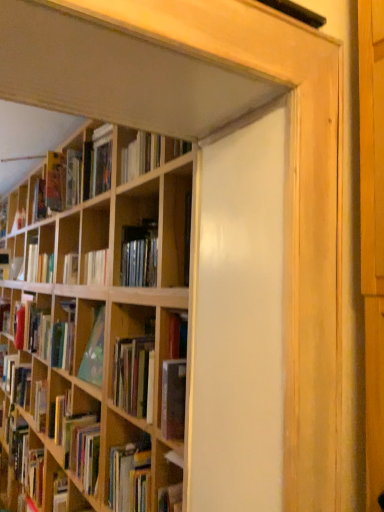
Question: Is hardcover book at upper left, the 1th book in the front-to-back sequence, bigger or smaller than matte red book at left, which ranks as the first book in bottom-to-top order?

Choices:
 (A) big
 (B) small

Answer: (A)

Question: In the image, is hardcover book at upper left, which is the first book in right-to-left order, on the left side or the right side of matte red book at left, which is the 2th book from right to left?

Choices:
 (A) left
 (B) right

Answer: (B)

Question: Choose the correct answer: Is hardcover book at upper left, the 1th book viewed from the top, inside matte red book at left, which ranks as the first book in bottom-to-top order, or outside it?

Choices:
 (A) outside
 (B) inside

Answer: (A)

Question: From a real-world perspective, relative to hardcover book at upper left, the 1th book in the front-to-back sequence, is matte red book at left, the 2th book viewed from the front, vertically above or below?

Choices:
 (A) above
 (B) below

Answer: (B)

Question: Relative to hardcover book at upper left, which is the first book in right-to-left order, is matte red book at left, the second book positioned from the top, in front or behind?

Choices:
 (A) front
 (B) behind

Answer: (B)

Question: Considering the positions of matte red book at left, the first book from the left, and hardcover book at upper left, which is the first book in right-to-left order, in the image, is matte red book at left, the first book from the left, bigger or smaller than hardcover book at upper left, which is the first book in right-to-left order,?

Choices:
 (A) big
 (B) small

Answer: (B)

Question: Looking at their shapes, would you say matte red book at left, the 2th book viewed from the front, is wider or thinner than hardcover book at upper left, the 1th book in the front-to-back sequence?

Choices:
 (A) wide
 (B) thin

Answer: (B)